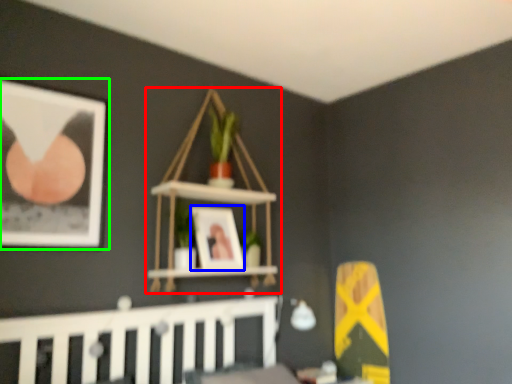
Question: Which object is positioned closest to shelf (highlighted by a red box)? Select from picture frame (highlighted by a blue box) and picture frame (highlighted by a green box).

Choices:
 (A) picture frame
 (B) picture frame

Answer: (A)